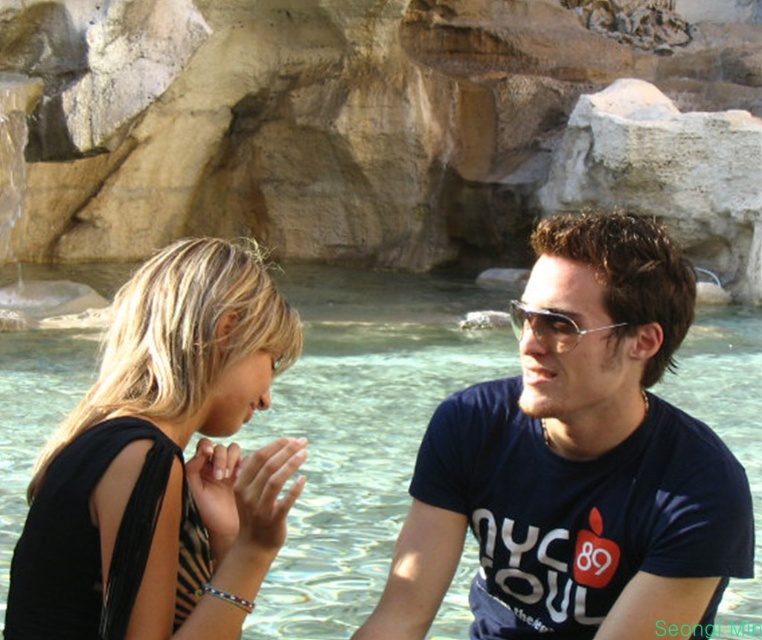
Question: Among these objects, which one is farthest from the camera?

Choices:
 (A) black fabric dress at left
 (B) clear water at center
 (C) beige stone rock formation at upper center
 (D) metallic silver sunglasses at center

Answer: (C)

Question: Is beige stone rock formation at upper center to the right of clear water at center from the viewer's perspective?

Choices:
 (A) yes
 (B) no

Answer: (A)

Question: Can you confirm if clear water at center is smaller than black fabric dress at left?

Choices:
 (A) no
 (B) yes

Answer: (A)

Question: Which point is closer to the camera?

Choices:
 (A) black fabric dress at left
 (B) metallic silver sunglasses at center
 (C) clear water at center

Answer: (A)

Question: Which object is closer to the camera taking this photo?

Choices:
 (A) dark blue t-shirt at center
 (B) beige stone rock formation at upper center
 (C) clear water at center
 (D) metallic silver sunglasses at center

Answer: (A)

Question: Can you confirm if dark blue t-shirt at center is positioned above metallic silver sunglasses at center?

Choices:
 (A) yes
 (B) no

Answer: (B)